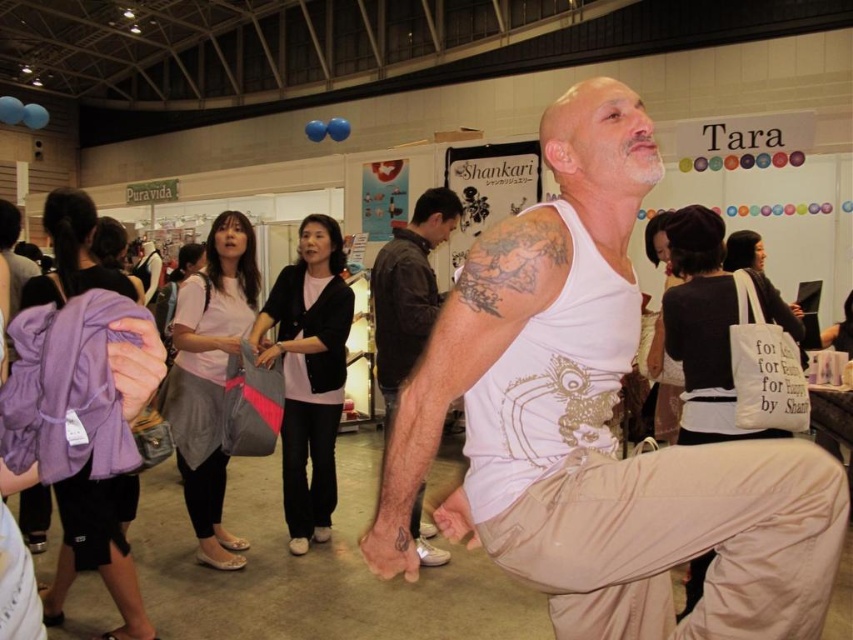
Does white matte tank top at center have a greater height compared to hairy skin tattoo at center?

Incorrect, white matte tank top at center's height is not larger of hairy skin tattoo at center's.

Describe the element at coordinates (596, 426) in the screenshot. I see `white matte tank top at center` at that location.

Is point (838, 557) in front of point (450, 212)?

Yes, it is.

Identify the location of white matte tank top at center. The height and width of the screenshot is (640, 853). (596, 426).